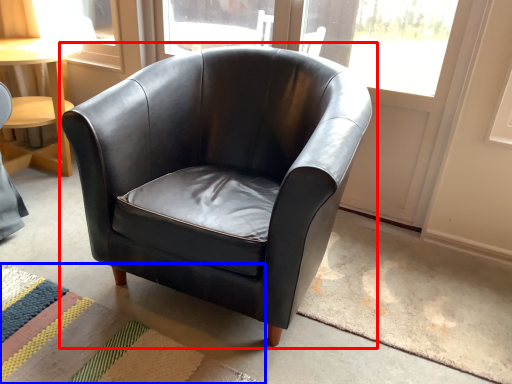
Question: Among these objects, which one is farthest to the camera, chair (highlighted by a red box) or mat (highlighted by a blue box)?

Choices:
 (A) chair
 (B) mat

Answer: (B)